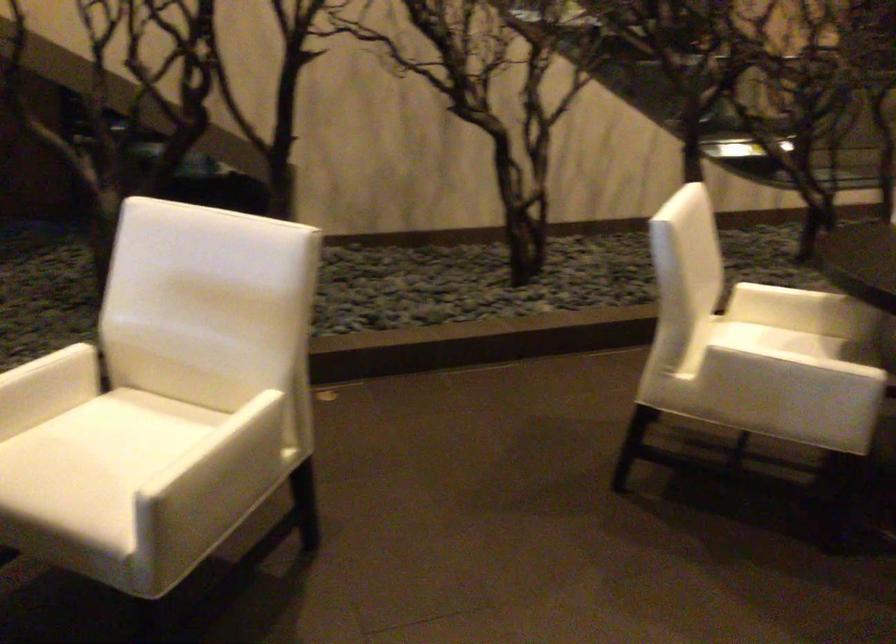
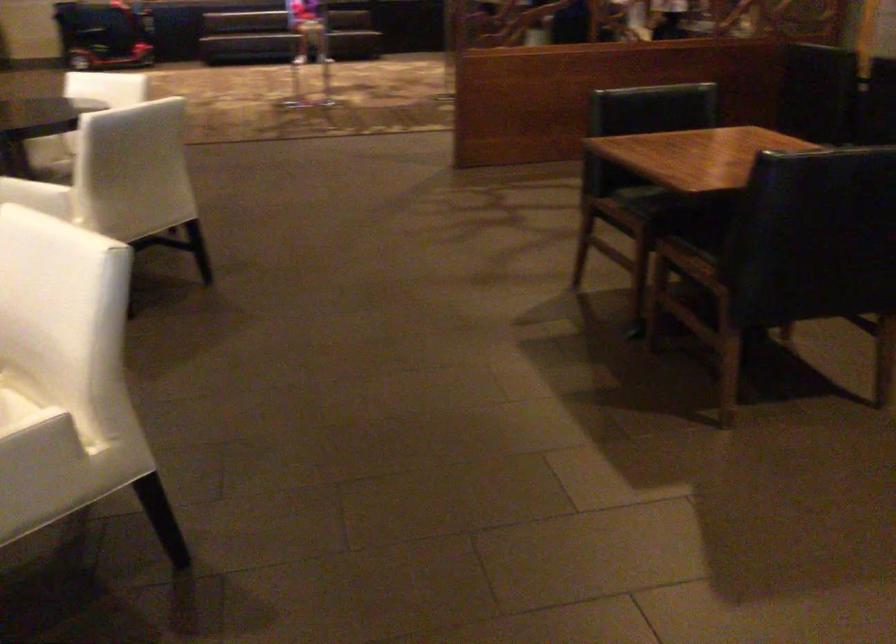
The images are taken continuously from a first-person perspective. In which direction is your viewpoint rotating?

The camera rotated toward right-down.